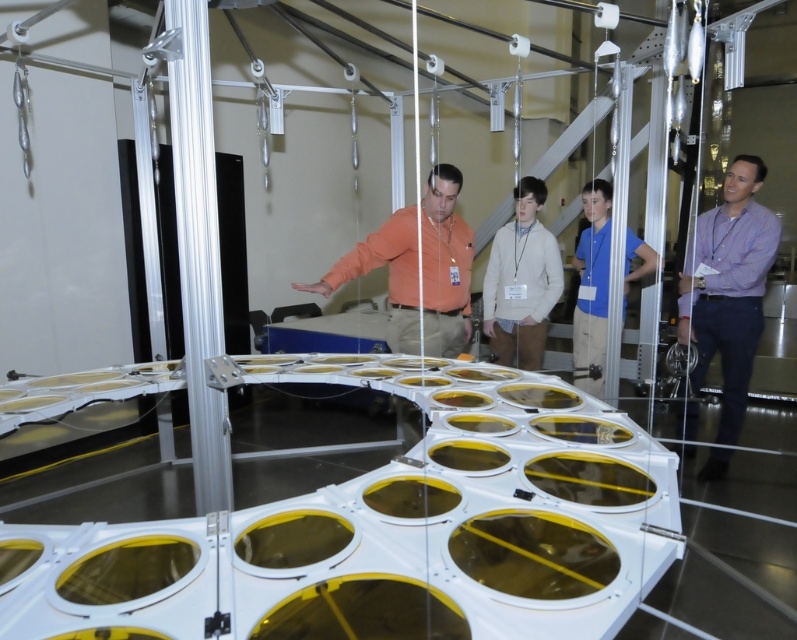
Question: Does orange fabric shirt at center come in front of white sweater at center?

Choices:
 (A) no
 (B) yes

Answer: (B)

Question: Is purple shirt at right thinner than orange fabric shirt at center?

Choices:
 (A) yes
 (B) no

Answer: (A)

Question: Which point is farther to the camera?

Choices:
 (A) (764, 214)
 (B) (442, 346)

Answer: (B)

Question: Does orange fabric shirt at center have a larger size compared to white sweater at center?

Choices:
 (A) no
 (B) yes

Answer: (B)

Question: Estimate the real-world distances between objects in this image. Which object is farther from the blue shirt at center?

Choices:
 (A) white sweater at center
 (B) purple shirt at right

Answer: (B)

Question: Which point is farther to the camera?

Choices:
 (A) white sweater at center
 (B) orange fabric shirt at center
 (C) blue shirt at center

Answer: (A)